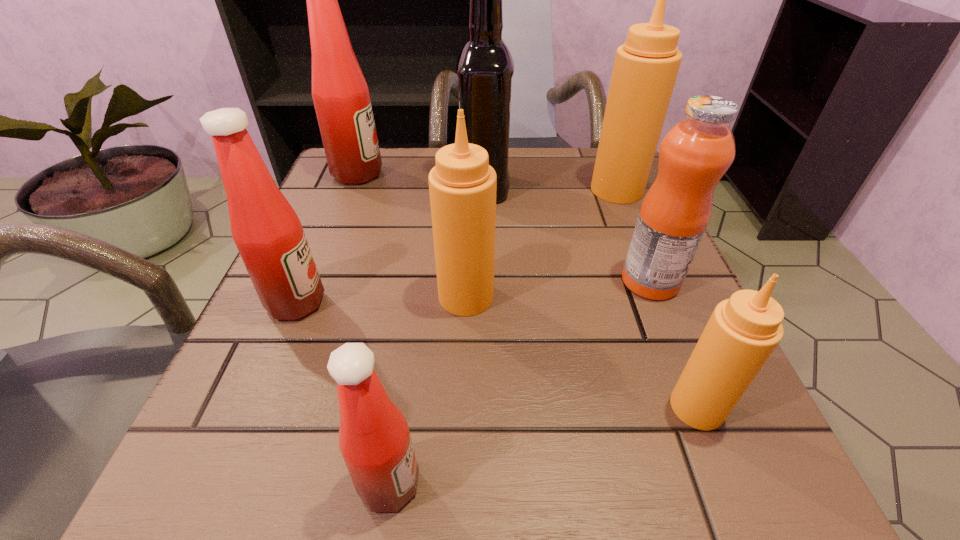
Where is `vacant space that satisfies the following two spatial constraints: 1. on the front-facing side of the biggest tan condiment; 2. on the left side of the liquor`? Image resolution: width=960 pixels, height=540 pixels. vacant space that satisfies the following two spatial constraints: 1. on the front-facing side of the biggest tan condiment; 2. on the left side of the liquor is located at coordinates (484, 190).

You are a GUI agent. You are given a task and a screenshot of the screen. Output one action in this format:
    pyautogui.click(x=<x>, y=<y>)
    Task: Click on the vacant space that satisfies the following two spatial constraints: 1. on the front side of the leftmost tan condiment; 2. on the front-facing side of the second biggest red condiment
    This screenshot has height=540, width=960.
    Given the screenshot: What is the action you would take?
    pyautogui.click(x=466, y=302)

Where is `vacant position in the image that satisfies the following two spatial constraints: 1. on the front side of the second biggest tan condiment; 2. on the front-facing side of the second nearest red condiment`? vacant position in the image that satisfies the following two spatial constraints: 1. on the front side of the second biggest tan condiment; 2. on the front-facing side of the second nearest red condiment is located at coordinates (466, 302).

I want to click on vacant point that satisfies the following two spatial constraints: 1. on the front side of the leftmost tan condiment; 2. on the right side of the nearest tan condiment, so click(463, 407).

The width and height of the screenshot is (960, 540). I want to click on free space that satisfies the following two spatial constraints: 1. on the back side of the farthest tan condiment; 2. on the front-facing side of the biggest red condiment, so click(610, 174).

This screenshot has height=540, width=960. I want to click on free space in the image that satisfies the following two spatial constraints: 1. on the front-facing side of the seventh farthest object; 2. on the right side of the farthest red condiment, so click(x=265, y=407).

This screenshot has height=540, width=960. In order to click on vacant position in the image that satisfies the following two spatial constraints: 1. on the front-facing side of the smallest tan condiment; 2. on the right side of the second farthest red condiment in this screenshot , I will do `click(252, 407)`.